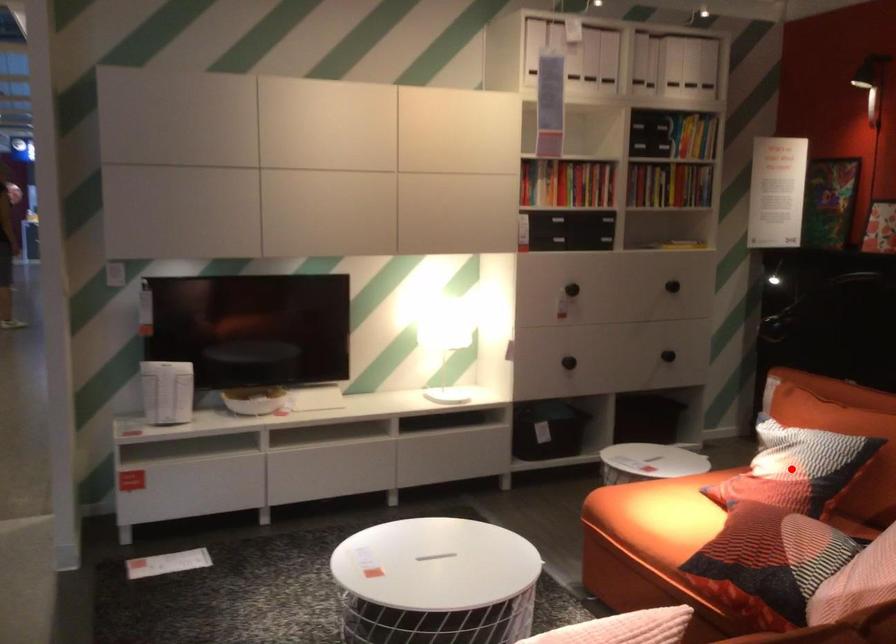
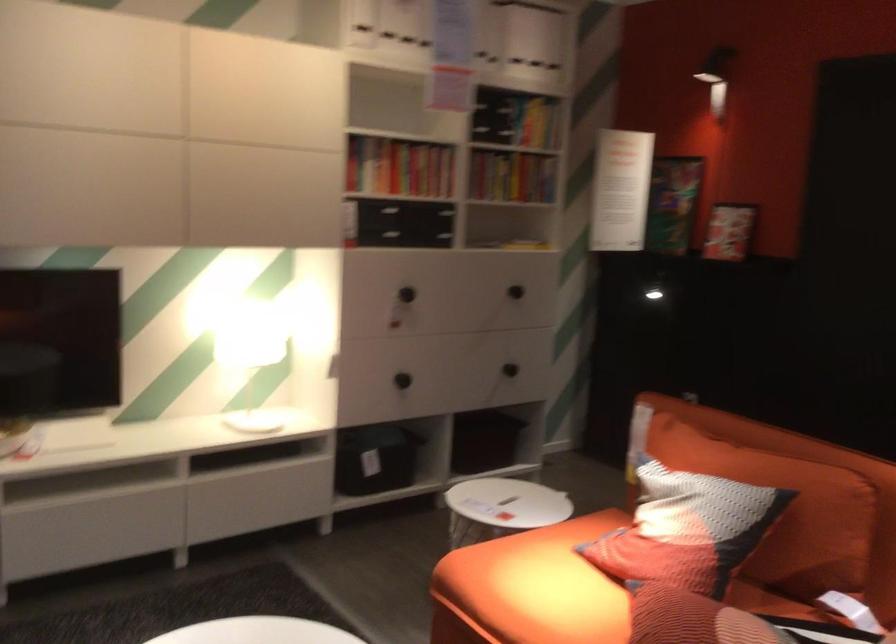
Question: I am providing you with two images of the same scene from different viewpoints. A red point is shown in image1. For the corresponding object point in image2, is it positioned nearer or farther from the camera?

Choices:
 (A) Nearer
 (B) Farther

Answer: (A)